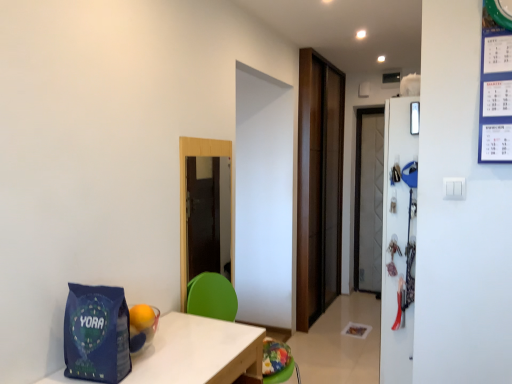
Describe the element at coordinates (96, 334) in the screenshot. I see `blue matte gift bag at lower left` at that location.

Measure the distance between point (226, 345) and camera.

A distance of 1.71 meters exists between point (226, 345) and camera.

The height and width of the screenshot is (384, 512). What do you see at coordinates (199, 352) in the screenshot?
I see `white wood table at lower left` at bounding box center [199, 352].

The width and height of the screenshot is (512, 384). Describe the element at coordinates (398, 243) in the screenshot. I see `white glossy refrigerator at right` at that location.

What do you see at coordinates (185, 196) in the screenshot?
I see `transparent wooden door at center` at bounding box center [185, 196].

You are a GUI agent. You are given a task and a screenshot of the screen. Output one action in this format:
    pyautogui.click(x=<x>, y=<y>)
    Task: Click on the transparent wooden door at center
    The height and width of the screenshot is (384, 512).
    Given the screenshot: What is the action you would take?
    pyautogui.click(x=185, y=196)

This screenshot has height=384, width=512. What are the coordinates of `blue matte gift bag at lower left` in the screenshot? It's located at (96, 334).

Is transparent wooden door at center turned away from green plastic chair at center?

No, green plastic chair at center is not at the back of transparent wooden door at center.

Considering the points (210, 150) and (280, 353), which point is in front, point (210, 150) or point (280, 353)?

The point (280, 353) is more forward.

Is transparent wooden door at center to the left of green plastic chair at center from the viewer's perspective?

Indeed, transparent wooden door at center is positioned on the left side of green plastic chair at center.

Is white wood table at lower left facing towards transparent wooden door at center?

No, white wood table at lower left is not facing towards transparent wooden door at center.

Which object is closer to the camera taking this photo, white wood table at lower left or transparent wooden door at center?

Positioned in front is white wood table at lower left.

This screenshot has height=384, width=512. I want to click on glass door above the white wood table at lower left (from a real-world perspective), so click(x=185, y=196).

Does point (340, 221) come farther from viewer compared to point (118, 342)?

Yes.

Which object is positioned more to the left, brown wood door at center or blue matte gift bag at lower left?

Positioned to the left is blue matte gift bag at lower left.

Which object is wider, brown wood door at center or blue matte gift bag at lower left?

Wider between the two is blue matte gift bag at lower left.

Where is `door that appears on the right of blue matte gift bag at lower left`? door that appears on the right of blue matte gift bag at lower left is located at coordinates (318, 186).

Which is in front, blue matte gift bag at lower left or brown wood door at center?

blue matte gift bag at lower left is closer to the camera.

Can you confirm if blue matte gift bag at lower left is positioned to the right of brown wood door at center?

No.

Is blue matte gift bag at lower left completely or partially outside of brown wood door at center?

blue matte gift bag at lower left lies outside brown wood door at center's area.

Is blue matte gift bag at lower left oriented towards brown wood door at center?

No.

Is blue matte gift bag at lower left at the back of transparent wooden door at center?

No, transparent wooden door at center's orientation is not away from blue matte gift bag at lower left.

Is transparent wooden door at center taller than blue matte gift bag at lower left?

Correct, transparent wooden door at center is much taller as blue matte gift bag at lower left.

Looking at this image, from a real-world perspective, who is located lower, transparent wooden door at center or blue matte gift bag at lower left?

blue matte gift bag at lower left, from a real-world perspective.

Which object is positioned more to the right, white glossy refrigerator at right or green plastic chair at center?

From the viewer's perspective, white glossy refrigerator at right appears more on the right side.

Does point (401, 99) come in front of point (270, 339)?

Yes, point (401, 99) is in front of point (270, 339).

Is white glossy refrigerator at right touching green plastic chair at center?

There is a gap between white glossy refrigerator at right and green plastic chair at center.

From a real-world perspective, does white glossy refrigerator at right sit lower than green plastic chair at center?

No, from a real-world perspective, white glossy refrigerator at right is not beneath green plastic chair at center.

Is there a large distance between white glossy refrigerator at right and blue matte gift bag at lower left?

Absolutely, white glossy refrigerator at right is distant from blue matte gift bag at lower left.

Locate an element on the screen. refrigerator located above the blue matte gift bag at lower left (from the image's perspective) is located at coordinates (398, 243).

Which point is more forward, (x=383, y=217) or (x=127, y=365)?

The point (x=127, y=365) is more forward.

Can we say white glossy refrigerator at right lies outside blue matte gift bag at lower left?

Absolutely, white glossy refrigerator at right is external to blue matte gift bag at lower left.

The width and height of the screenshot is (512, 384). I want to click on glass door on the left of green plastic chair at center, so click(185, 196).

There is a white wood table at lower left. At what (x,y) coordinates should I click in order to perform the action: click on glass door above it (from a real-world perspective). Please return your answer as a coordinate pair (x, y). The height and width of the screenshot is (384, 512). Looking at the image, I should click on (185, 196).

Considering their positions, is blue matte gift bag at lower left positioned closer to white wood table at lower left than brown wood door at center?

Based on the image, blue matte gift bag at lower left appears to be nearer to white wood table at lower left.

Which object lies nearer to the anchor point white wood table at lower left, transparent wooden door at center or white glossy refrigerator at right?

transparent wooden door at center lies closer to white wood table at lower left than the other object.

Estimate the real-world distances between objects in this image. Which object is closer to white wood table at lower left, white glossy refrigerator at right or brown wood door at center?

Among the two, white glossy refrigerator at right is located nearer to white wood table at lower left.

Which object lies further to the anchor point blue matte gift bag at lower left, green plastic chair at center or white glossy refrigerator at right?

The object further to blue matte gift bag at lower left is white glossy refrigerator at right.

Based on their spatial positions, is blue matte gift bag at lower left or white wood table at lower left further from white glossy refrigerator at right?

blue matte gift bag at lower left is further to white glossy refrigerator at right.

When comparing their distances from white glossy refrigerator at right, does brown wood door at center or blue matte gift bag at lower left seem closer?

blue matte gift bag at lower left lies closer to white glossy refrigerator at right than the other object.

From the picture: Which object lies further to the anchor point white glossy refrigerator at right, white wood table at lower left or transparent wooden door at center?

transparent wooden door at center is positioned further to the anchor white glossy refrigerator at right.

Which object lies further to the anchor point white glossy refrigerator at right, white wood table at lower left or green plastic chair at center?

The object further to white glossy refrigerator at right is green plastic chair at center.

Identify the location of armchair between blue matte gift bag at lower left and brown wood door at center from front to back. (212, 297).

This screenshot has width=512, height=384. I want to click on glass door between blue matte gift bag at lower left and brown wood door at center from front to back, so click(185, 196).

Where is `armchair between blue matte gift bag at lower left and white glossy refrigerator at right in the horizontal direction`? armchair between blue matte gift bag at lower left and white glossy refrigerator at right in the horizontal direction is located at coordinates (212, 297).

I want to click on gift bag between white wood table at lower left and transparent wooden door at center along the z-axis, so click(96, 334).